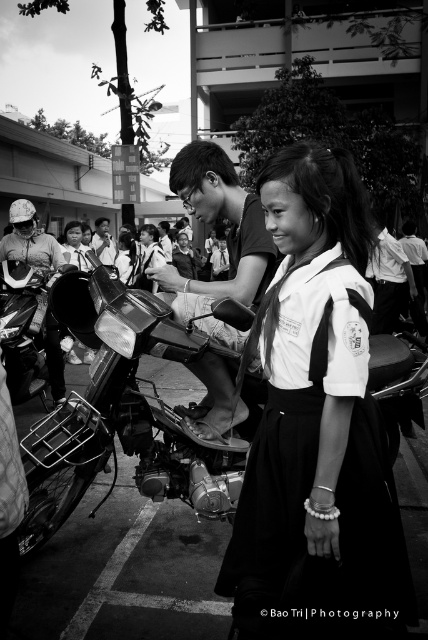
Question: Is white uniform at center thinner than metallic chrome motorcycle at center?

Choices:
 (A) no
 (B) yes

Answer: (B)

Question: Among these points, which one is nearest to the camera?

Choices:
 (A) pyautogui.click(x=330, y=616)
 (B) pyautogui.click(x=29, y=477)

Answer: (A)

Question: Can you confirm if white uniform at center is bigger than metallic chrome motorcycle at center?

Choices:
 (A) yes
 (B) no

Answer: (B)

Question: Which object is closer to the camera taking this photo?

Choices:
 (A) white uniform at center
 (B) metallic chrome motorcycle at center

Answer: (A)

Question: Can you confirm if white uniform at center is positioned above metallic chrome motorcycle at center?

Choices:
 (A) no
 (B) yes

Answer: (B)